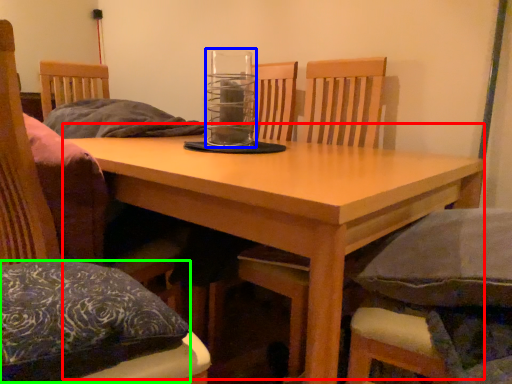
Question: Which object is the closest to the table (highlighted by a red box)? Choose among these: glass jar (highlighted by a blue box) or pillow (highlighted by a green box).

Choices:
 (A) glass jar
 (B) pillow

Answer: (B)